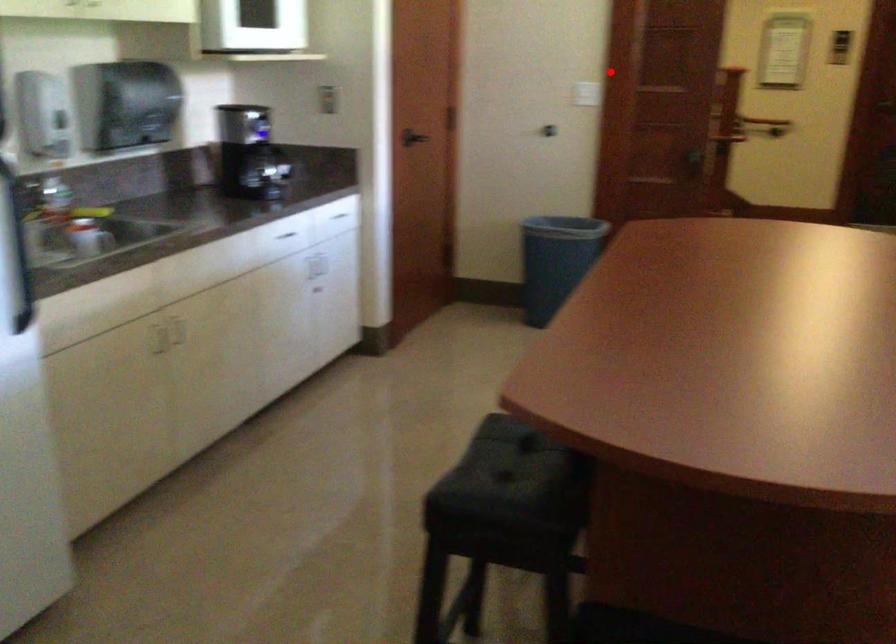
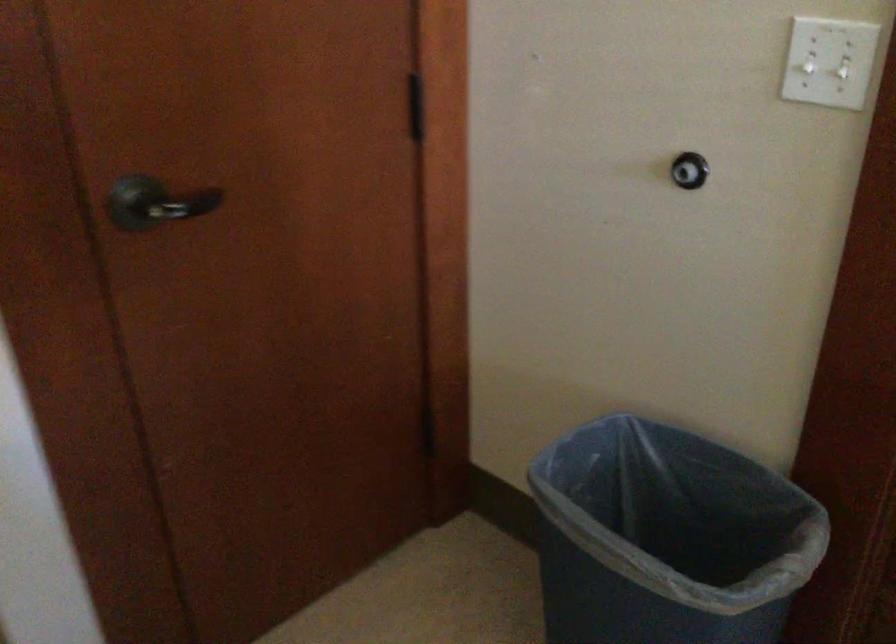
Question: I am providing you with two images of the same scene from different viewpoints. Given a red point in image1, look at the same physical point in image2. Is it:

Choices:
 (A) Closer to the viewpoint
 (B) Farther from the viewpoint

Answer: (A)